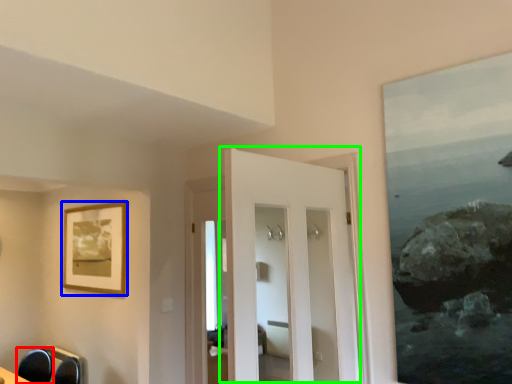
Question: Which object is the closest to the swivel chair (highlighted by a red box)? Choose among these: picture frame (highlighted by a blue box) or door (highlighted by a green box).

Choices:
 (A) picture frame
 (B) door

Answer: (A)